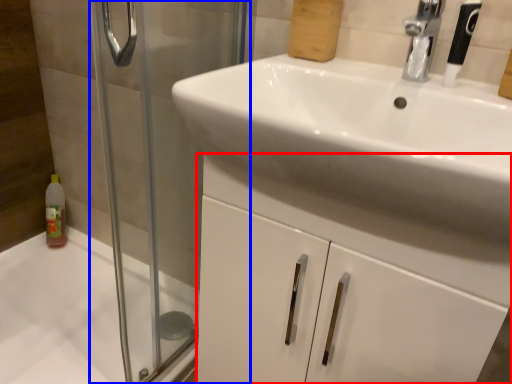
Question: Which point is closer to the camera, bathroom cabinet (highlighted by a red box) or screen door (highlighted by a blue box)?

Choices:
 (A) bathroom cabinet
 (B) screen door

Answer: (B)